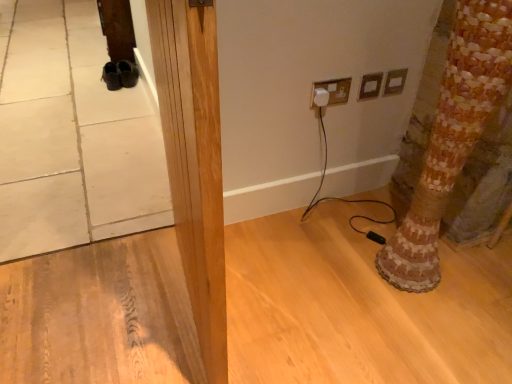
In order to click on vacant area that is situated to the right of natural wood pillar at center in this screenshot , I will do `click(309, 298)`.